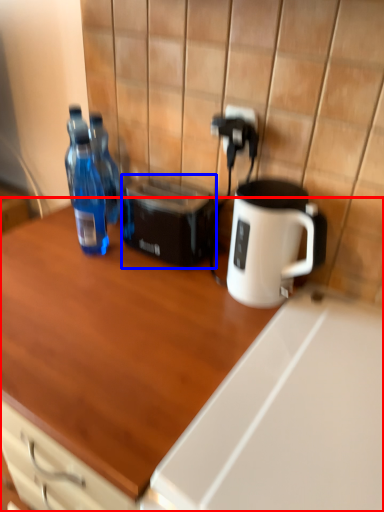
Question: Among these objects, which one is nearest to the camera, desk (highlighted by a red box) or toaster (highlighted by a blue box)?

Choices:
 (A) desk
 (B) toaster

Answer: (A)